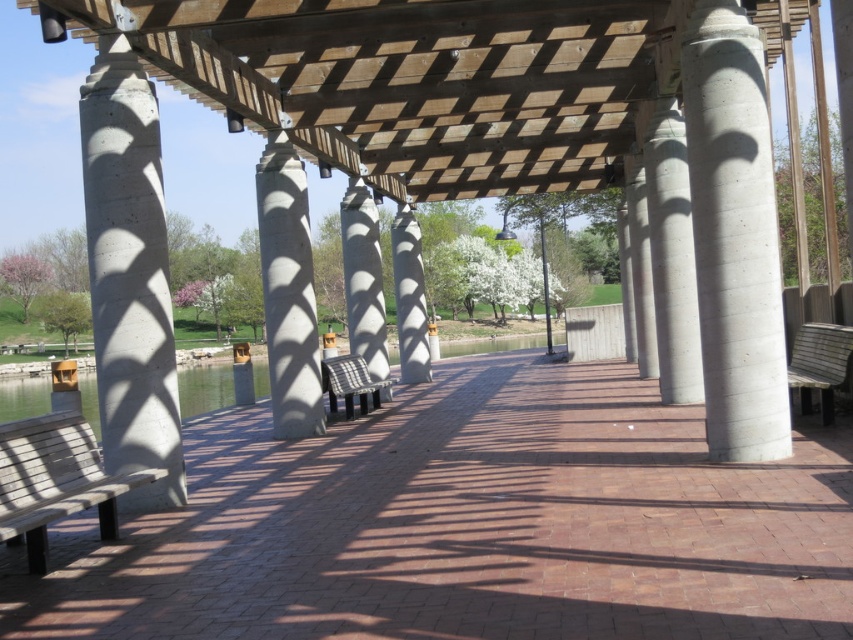
You are standing at the point marked as point (126,476) and want to walk to the other side of the walkway. The walkway is 6.41 meters long. If you walk at a speed of 1.2 meters per second, how long will it take you to reach the other side?

The walkway is 6.41 meters long, and you walk at 1.2 meters per second. To calculate the time, divide the distance by the speed. 6.41 divided by 1.2 equals approximately 5.34 seconds. Therefore, it will take about 5.34 seconds to reach the other side.

You are a painter who wants to set up your easel between the wooden bench at lower left and the checkered fabric bench at center. You need at least 3 meters of space to move comfortably. Do you have enough space between them?

The wooden bench at lower left and checkered fabric bench at center are 6.85 meters apart from each other, so yes, there is enough space between them for the painter to move comfortably with at least 3 meters required.